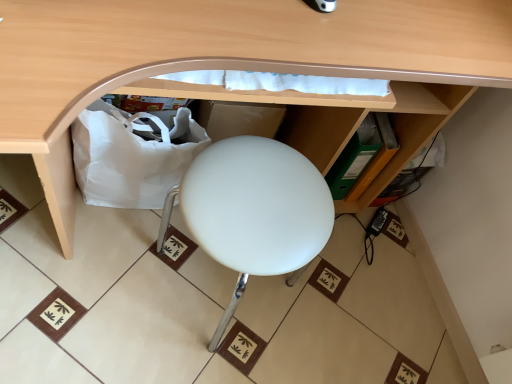
Question: Is matte wood desk at center wider than white matte stool at center?

Choices:
 (A) yes
 (B) no

Answer: (A)

Question: Is white matte stool at center surrounded by matte wood desk at center?

Choices:
 (A) yes
 (B) no

Answer: (A)

Question: Does matte wood desk at center come in front of white matte stool at center?

Choices:
 (A) yes
 (B) no

Answer: (A)

Question: Considering the relative sizes of matte wood desk at center and white matte stool at center in the image provided, is matte wood desk at center smaller than white matte stool at center?

Choices:
 (A) no
 (B) yes

Answer: (A)

Question: Can you confirm if matte wood desk at center is taller than white matte stool at center?

Choices:
 (A) yes
 (B) no

Answer: (A)

Question: From the image's perspective, would you say matte wood desk at center is positioned over white matte stool at center?

Choices:
 (A) no
 (B) yes

Answer: (B)

Question: Does white matte stool at center come behind white fabric bag at lower left?

Choices:
 (A) yes
 (B) no

Answer: (B)

Question: Is white matte stool at center not inside white fabric bag at lower left?

Choices:
 (A) no
 (B) yes

Answer: (B)

Question: Is white matte stool at center positioned in front of white fabric bag at lower left?

Choices:
 (A) no
 (B) yes

Answer: (B)

Question: Does white matte stool at center have a lesser width compared to white fabric bag at lower left?

Choices:
 (A) no
 (B) yes

Answer: (A)

Question: Can you see white matte stool at center touching white fabric bag at lower left?

Choices:
 (A) no
 (B) yes

Answer: (A)

Question: Does white matte stool at center appear on the right side of white fabric bag at lower left?

Choices:
 (A) yes
 (B) no

Answer: (A)

Question: Does matte wood desk at center have a greater height compared to white fabric bag at lower left?

Choices:
 (A) yes
 (B) no

Answer: (A)